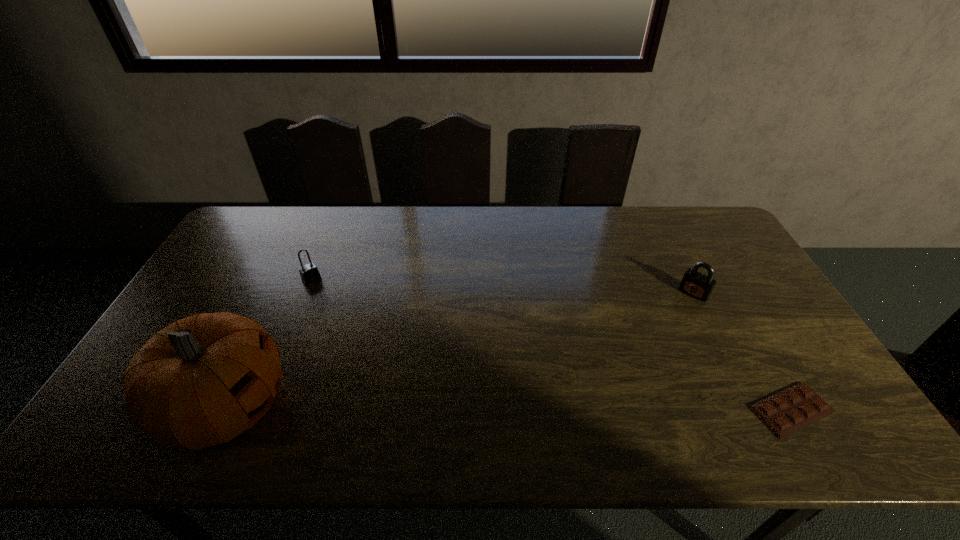
The image size is (960, 540). In order to click on vacant space in between the chocolate bar and the left padlock in this screenshot , I will do `click(551, 345)`.

Point out which object is positioned as the third nearest to the tallest object. Please provide its 2D coordinates. Your answer should be formatted as a tuple, i.e. [(x, y)], where the tuple contains the x and y coordinates of a point satisfying the conditions above.

[(786, 412)]

Where is `the closest object to the shortest object`? the closest object to the shortest object is located at coordinates (697, 285).

Locate an element on the screen. The image size is (960, 540). free space that satisfies the following two spatial constraints: 1. on the front side of the left padlock; 2. on the left side of the right padlock is located at coordinates (306, 293).

Locate an element on the screen. Image resolution: width=960 pixels, height=540 pixels. blank area in the image that satisfies the following two spatial constraints: 1. on the front side of the right padlock; 2. on the right side of the left padlock is located at coordinates (306, 293).